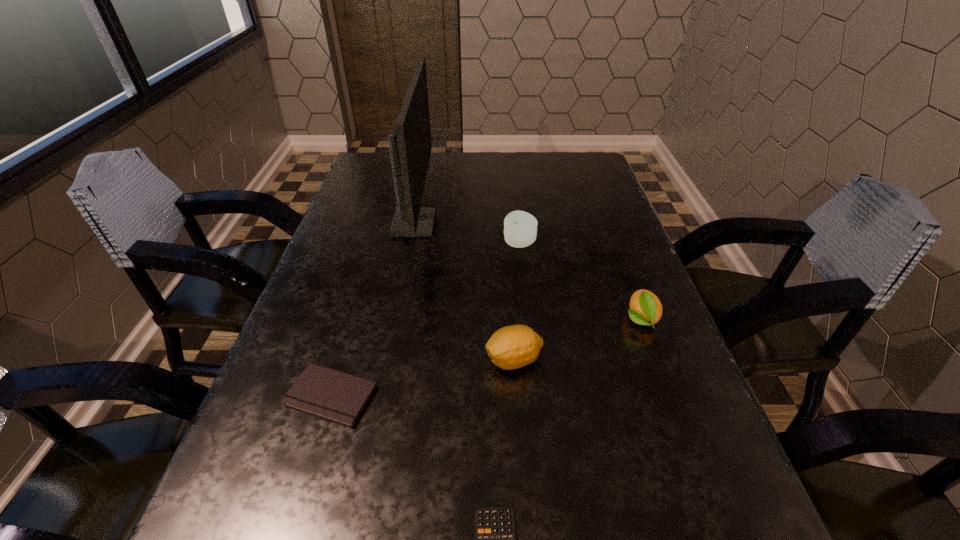
This screenshot has height=540, width=960. What are the coordinates of `computer monitor` in the screenshot? It's located at (410, 150).

Where is `apple`? apple is located at coordinates point(520,228).

This screenshot has width=960, height=540. Identify the location of the nearer lemon. (511, 347).

Locate an element on the screen. The width and height of the screenshot is (960, 540). the rightmost object is located at coordinates (646, 309).

Where is `the right lemon`? the right lemon is located at coordinates (646, 309).

You are a GUI agent. You are given a task and a screenshot of the screen. Output one action in this format:
    pyautogui.click(x=<x>, y=<y>)
    Task: Click on the fifth tallest object
    
    Given the screenshot: What is the action you would take?
    pyautogui.click(x=336, y=396)

The image size is (960, 540). I want to click on free region located 0.180m on the front-facing side of the computer monitor, so click(502, 223).

Identify the location of vacant space located on the left of the apple. (422, 244).

Locate an element on the screen. vacant region located 0.110m at the stem end of the left lemon is located at coordinates (426, 360).

Where is `free space located at the stem end of the left lemon`? free space located at the stem end of the left lemon is located at coordinates point(362,360).